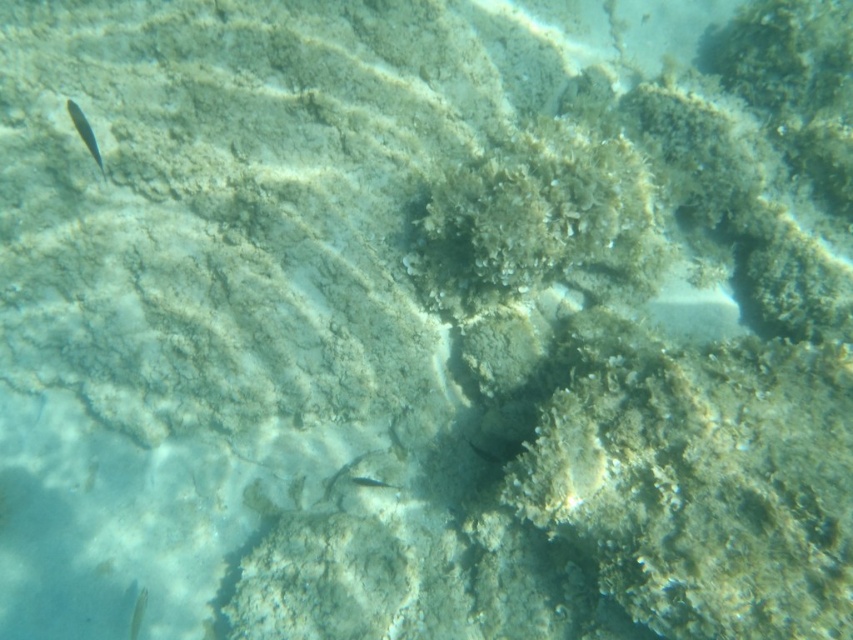
Consider the image. Measure the distance from green translucent fish at upper left to translucent clear fish at lower left.

green translucent fish at upper left and translucent clear fish at lower left are 1.29 meters apart.

Between point (94, 157) and point (138, 627), which one is positioned behind?

Point (138, 627)

Find the location of `green translucent fish at upper left`. green translucent fish at upper left is located at coordinates (84, 132).